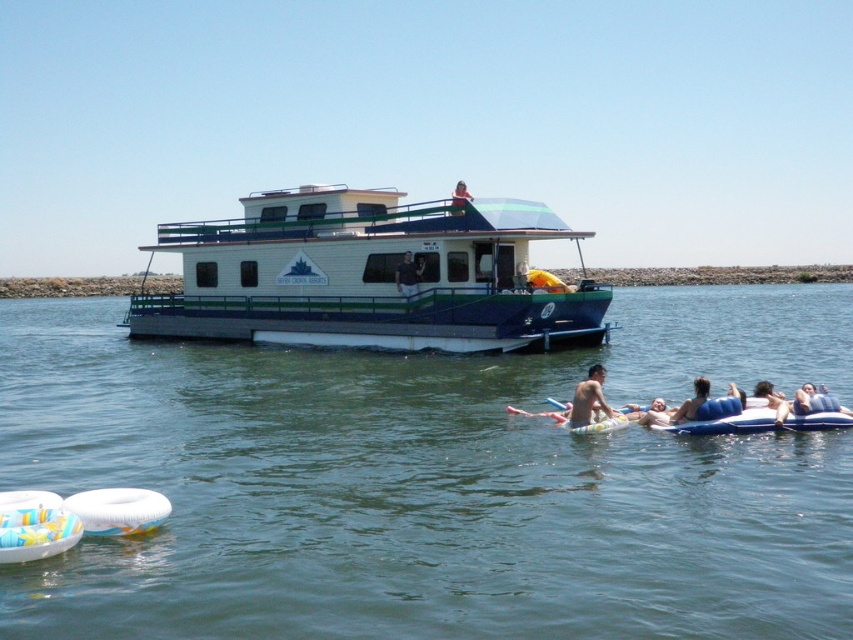
Can you confirm if white glossy houseboat at center is taller than blue rubber ring at lower right?

Correct, white glossy houseboat at center is much taller as blue rubber ring at lower right.

Is point (413, 204) closer to camera compared to point (706, 397)?

No, it is not.

Is point (273, 193) in front of point (689, 401)?

No.

This screenshot has height=640, width=853. I want to click on white glossy houseboat at center, so click(x=369, y=275).

Is green smooth water at center below skinny man at center?

No, green smooth water at center is not below skinny man at center.

Where is `green smooth water at center`? The width and height of the screenshot is (853, 640). green smooth water at center is located at coordinates (433, 481).

Which of these two, green smooth water at center or blue rubber ring at lower right, stands shorter?

blue rubber ring at lower right

Which is more to the right, green smooth water at center or blue rubber ring at lower right?

blue rubber ring at lower right

What do you see at coordinates (433, 481) in the screenshot? I see `green smooth water at center` at bounding box center [433, 481].

Locate an element on the screen. The image size is (853, 640). green smooth water at center is located at coordinates (433, 481).